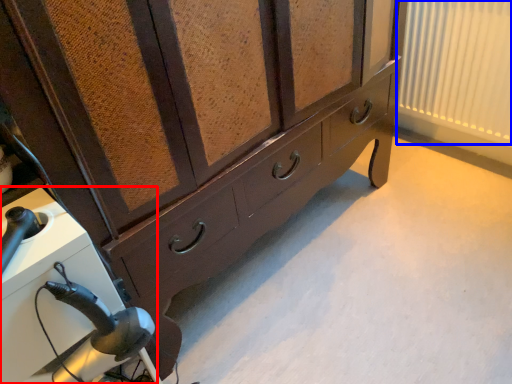
Question: Among these objects, which one is farthest to the camera, appliance (highlighted by a red box) or curtain (highlighted by a blue box)?

Choices:
 (A) appliance
 (B) curtain

Answer: (B)